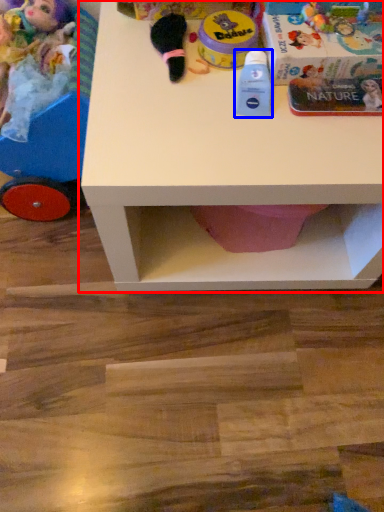
Question: Which of the following is the closest to the observer, table (highlighted by a red box) or toy (highlighted by a blue box)?

Choices:
 (A) table
 (B) toy

Answer: (A)